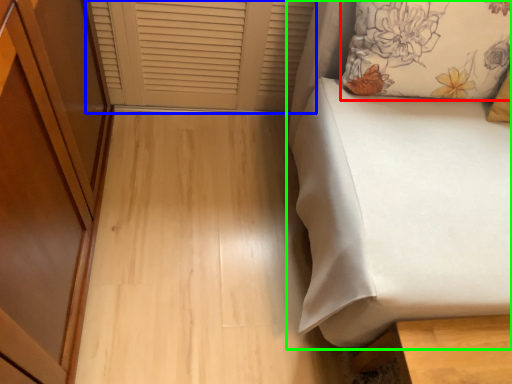
Question: Based on their relative distances, which object is nearer to pillow (highlighted by a red box)? Choose from window frame (highlighted by a blue box) and furniture (highlighted by a green box).

Choices:
 (A) window frame
 (B) furniture

Answer: (B)